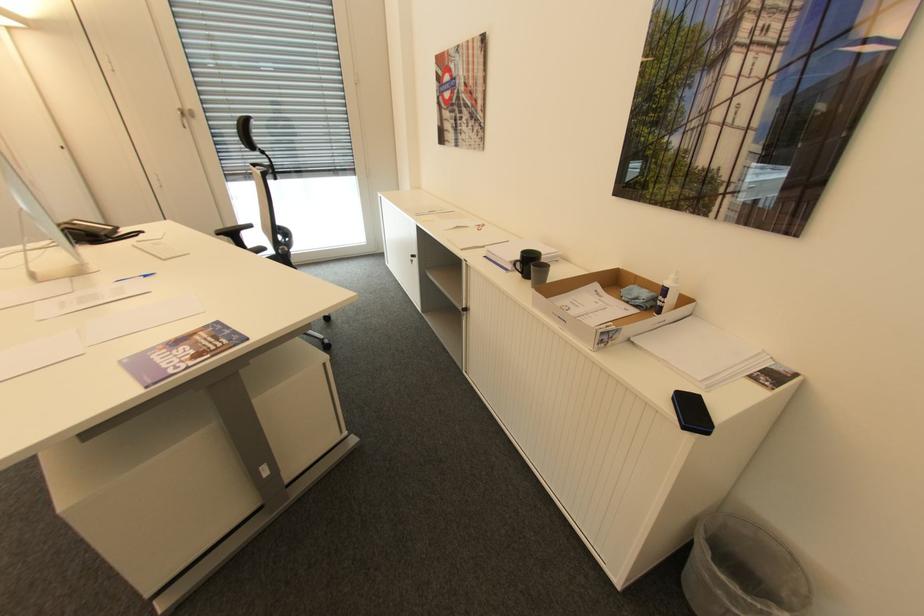
Locate an element on the screen. The width and height of the screenshot is (924, 616). cardboard box lid is located at coordinates (603, 306).